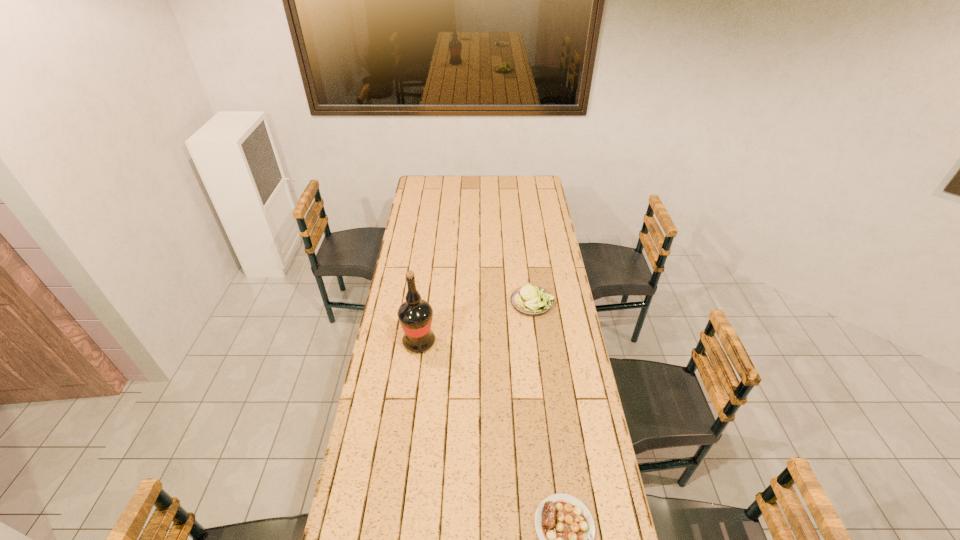
At what (x,y) coordinates should I click in order to perform the action: click on the tallest object. Please return your answer as a coordinate pair (x, y). Looking at the image, I should click on (415, 315).

This screenshot has width=960, height=540. I want to click on wine bottle, so click(x=415, y=315).

Image resolution: width=960 pixels, height=540 pixels. Find the location of `the farthest object`. the farthest object is located at coordinates (529, 300).

Where is `lettuce`? Image resolution: width=960 pixels, height=540 pixels. lettuce is located at coordinates (529, 300).

Image resolution: width=960 pixels, height=540 pixels. I want to click on vacant space situated 0.230m on the back of the wine bottle, so click(x=426, y=292).

You are a GUI agent. You are given a task and a screenshot of the screen. Output one action in this format:
    pyautogui.click(x=<x>, y=<y>)
    Task: Click on the blank space located on the back of the lettuce
    This screenshot has height=540, width=960.
    Given the screenshot: What is the action you would take?
    pyautogui.click(x=530, y=281)

Where is `object that is at the left edge`? This screenshot has width=960, height=540. object that is at the left edge is located at coordinates (415, 315).

You are a GUI agent. You are given a task and a screenshot of the screen. Output one action in this format:
    pyautogui.click(x=<x>, y=<y>)
    Task: Click on the object situated at the right edge
    Image resolution: width=960 pixels, height=540 pixels.
    Given the screenshot: What is the action you would take?
    pyautogui.click(x=529, y=300)

This screenshot has height=540, width=960. Identify the location of free space at the left edge of the desktop. (427, 235).

Locate an element on the screen. The image size is (960, 540). vacant space at the right edge is located at coordinates pos(553,292).